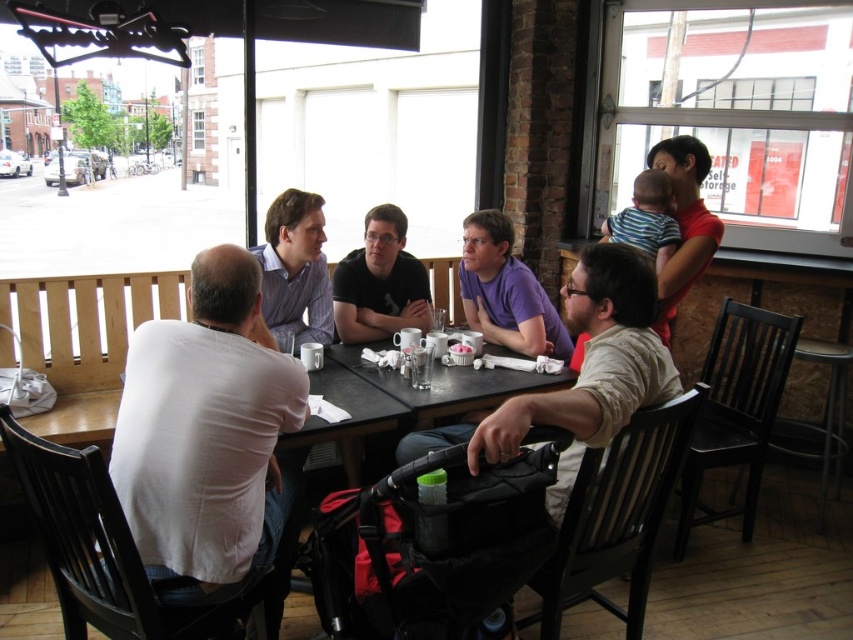
Measure the distance between white cotton shirt at center and camera.

5.23 feet

Does point (144, 420) lie behind point (694, 196)?

That is False.

The height and width of the screenshot is (640, 853). I want to click on white cotton shirt at center, so click(209, 440).

Which is below, purple cotton shirt at center or matte black shirt at upper right?

purple cotton shirt at center

Which is behind, point (485, 214) or point (666, 304)?

Point (485, 214)

Does point (489, 324) lie in front of point (715, 237)?

No, (489, 324) is further to viewer.

The image size is (853, 640). Find the location of `purple cotton shirt at center`. purple cotton shirt at center is located at coordinates click(x=505, y=291).

Does purple cotton shirt at center appear over matte black shirt at center?

Actually, purple cotton shirt at center is below matte black shirt at center.

Is purple cotton shirt at center wider than matte black shirt at center?

Indeed, purple cotton shirt at center has a greater width compared to matte black shirt at center.

Is point (508, 269) positioned before point (387, 227)?

Yes, it is in front of point (387, 227).

Identify the location of purple cotton shirt at center. Image resolution: width=853 pixels, height=640 pixels. (505, 291).